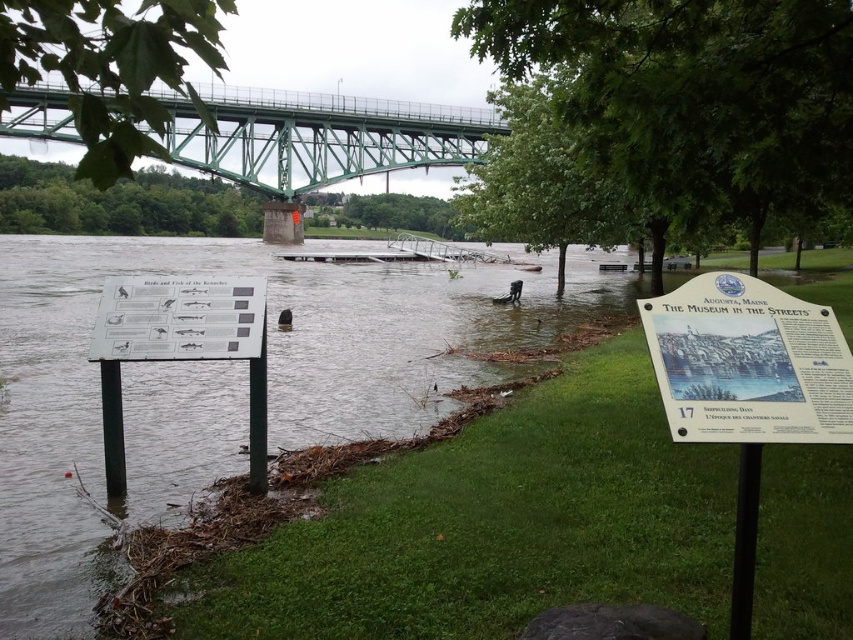
Question: Among these points, which one is farthest from the camera?

Choices:
 (A) (801, 440)
 (B) (47, 90)

Answer: (B)

Question: Which object is closer to the camera taking this photo?

Choices:
 (A) green steel bridge at upper center
 (B) white paper sign at lower right

Answer: (B)

Question: Which point is closer to the camera?

Choices:
 (A) (235, 106)
 (B) (680, 291)

Answer: (B)

Question: Where is white paper sign at lower right located in relation to green steel bridge at upper center in the image?

Choices:
 (A) right
 (B) left

Answer: (A)

Question: Is white paper sign at lower right to the right of green steel bridge at upper center from the viewer's perspective?

Choices:
 (A) no
 (B) yes

Answer: (B)

Question: Can you confirm if white paper sign at lower right is positioned above green steel bridge at upper center?

Choices:
 (A) no
 (B) yes

Answer: (A)